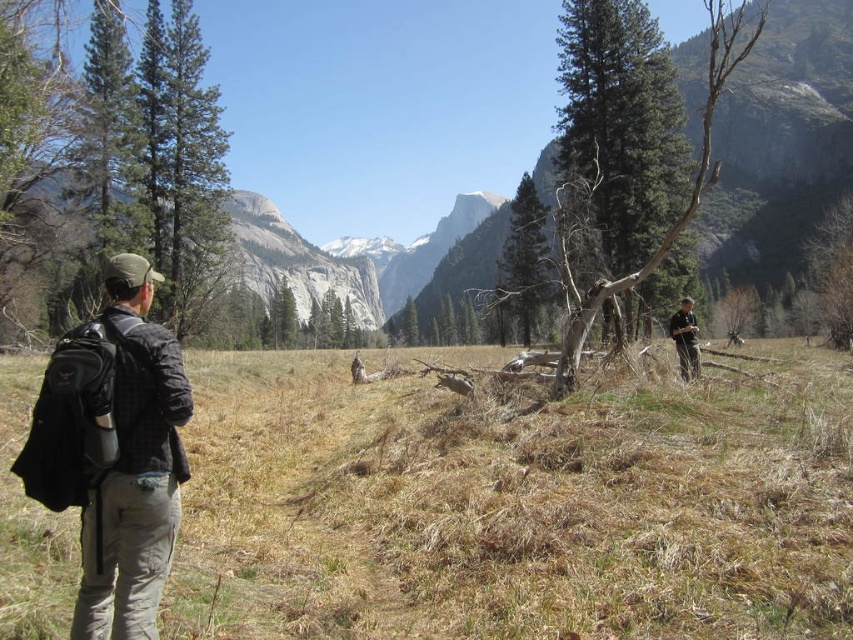
Question: Does green textured pine tree at center have a larger size compared to green matte tree at center?

Choices:
 (A) no
 (B) yes

Answer: (A)

Question: Does green textured pine tree at center appear over black fabric backpack at left?

Choices:
 (A) yes
 (B) no

Answer: (A)

Question: Does green textured pine tree at center appear over black fabric backpack at left?

Choices:
 (A) no
 (B) yes

Answer: (B)

Question: Estimate the real-world distances between objects in this image. Which object is farther from the green matte tree at center?

Choices:
 (A) brown grass at center
 (B) green textured pine tree at center
 (C) black fabric backpack at left

Answer: (C)

Question: Which is nearer to the brown grass at center?

Choices:
 (A) green textured pine tree at center
 (B) dark brown leather jacket at right
 (C) green matte tree at center
 (D) black fabric backpack at left

Answer: (D)

Question: Which object is farther from the camera taking this photo?

Choices:
 (A) black fabric backpack at left
 (B) green textured pine tree at center

Answer: (B)